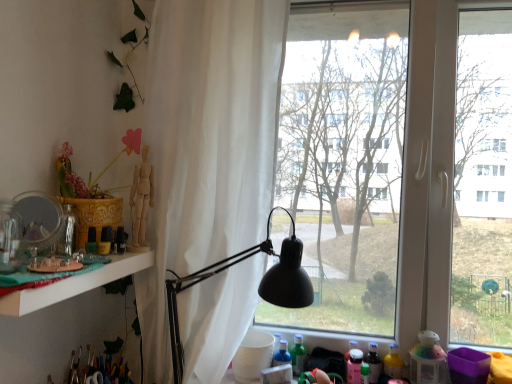
Locate an element on the screen. The image size is (512, 384). white sheer curtain at center is located at coordinates (207, 144).

Image resolution: width=512 pixels, height=384 pixels. What do you see at coordinates (298, 355) in the screenshot?
I see `green matte bottle at lower center, which is the second bottle in right-to-left order` at bounding box center [298, 355].

What do you see at coordinates (373, 363) in the screenshot? The width and height of the screenshot is (512, 384). I see `translucent plastic bottle at lower right, the 2th bottle from the left` at bounding box center [373, 363].

Find the location of a particular element. white sheer curtain at center is located at coordinates (207, 144).

Between black matte lamp at center and white glossy shelf at left, which one has less height?

white glossy shelf at left is shorter.

From a real-world perspective, is black matte lamp at center above or below white glossy shelf at left?

Clearly, from a real-world perspective, black matte lamp at center is below white glossy shelf at left.

Is black matte lamp at center oriented away from white glossy shelf at left?

black matte lamp at center does not have its back to white glossy shelf at left.

Considering the relative sizes of green matte bottle at lower center, placed as the 1th bottle when sorted from left to right, and translucent plastic toy at lower right in the image provided, is green matte bottle at lower center, placed as the 1th bottle when sorted from left to right, smaller than translucent plastic toy at lower right?

Yes, green matte bottle at lower center, placed as the 1th bottle when sorted from left to right, is smaller than translucent plastic toy at lower right.

Is green matte bottle at lower center, placed as the 1th bottle when sorted from left to right, thinner than translucent plastic toy at lower right?

Yes, green matte bottle at lower center, placed as the 1th bottle when sorted from left to right, is thinner than translucent plastic toy at lower right.

From a real-world perspective, who is located lower, green matte bottle at lower center, which is the second bottle in right-to-left order, or translucent plastic toy at lower right?

From a 3D spatial view, green matte bottle at lower center, which is the second bottle in right-to-left order, is below.

Considering the relative sizes of green matte bottle at lower center, placed as the 1th bottle when sorted from left to right, and translucent plastic toy at lower right in the image provided, is green matte bottle at lower center, placed as the 1th bottle when sorted from left to right, taller than translucent plastic toy at lower right?

In fact, green matte bottle at lower center, placed as the 1th bottle when sorted from left to right, may be shorter than translucent plastic toy at lower right.

Does wooden mannequin at left have a smaller size compared to green matte bottle at lower center, which is the second bottle in right-to-left order?

No.

Find the location of `person located in front of the green matte bottle at lower center, placed as the 1th bottle when sorted from left to right`. person located in front of the green matte bottle at lower center, placed as the 1th bottle when sorted from left to right is located at coordinates (141, 200).

How distant is wooden mannequin at left from green matte bottle at lower center, placed as the 1th bottle when sorted from left to right?

The distance of wooden mannequin at left from green matte bottle at lower center, placed as the 1th bottle when sorted from left to right, is 73.19 centimeters.

In the scene shown: Is wooden mannequin at left facing towards green matte bottle at lower center, which is the second bottle in right-to-left order?

No, wooden mannequin at left is not aimed at green matte bottle at lower center, which is the second bottle in right-to-left order.

Are translucent plastic toy at lower right and white glossy shelf at left making contact?

No, translucent plastic toy at lower right is not beside white glossy shelf at left.

Considering the relative sizes of translucent plastic toy at lower right and white glossy shelf at left in the image provided, is translucent plastic toy at lower right taller than white glossy shelf at left?

Yes.

Can we say translucent plastic toy at lower right lies outside white glossy shelf at left?

Yes, translucent plastic toy at lower right is located beyond the bounds of white glossy shelf at left.

From the image's perspective, relative to white glossy shelf at left, is translucent plastic toy at lower right above or below?

translucent plastic toy at lower right is below white glossy shelf at left.

Which is more to the left, black matte lamp at center or green matte bottle at lower center, which is the second bottle in right-to-left order?

black matte lamp at center.

From the image's perspective, is black matte lamp at center located beneath green matte bottle at lower center, placed as the 1th bottle when sorted from left to right?

Incorrect, from the image's perspective, black matte lamp at center is higher than green matte bottle at lower center, placed as the 1th bottle when sorted from left to right.

Where is `lamp in front of the green matte bottle at lower center, which is the second bottle in right-to-left order`? The height and width of the screenshot is (384, 512). lamp in front of the green matte bottle at lower center, which is the second bottle in right-to-left order is located at coordinates (258, 288).

Is black matte lamp at center far away from green matte bottle at lower center, placed as the 1th bottle when sorted from left to right?

Actually, black matte lamp at center and green matte bottle at lower center, placed as the 1th bottle when sorted from left to right, are a little close together.

In terms of height, does translucent plastic toy at lower right look taller or shorter compared to matte silver mirror at left?

Clearly, translucent plastic toy at lower right is taller compared to matte silver mirror at left.

From the image's perspective, is translucent plastic toy at lower right positioned above or below matte silver mirror at left?

Clearly, from the image's perspective, translucent plastic toy at lower right is below matte silver mirror at left.

Is translucent plastic toy at lower right not close to matte silver mirror at left?

That's right, there is a large distance between translucent plastic toy at lower right and matte silver mirror at left.

Which is more distant, (294, 359) or (222, 263)?

The point (294, 359) is farther.

From a real-world perspective, relative to black matte lamp at center, is green matte bottle at lower center, which is the second bottle in right-to-left order, vertically above or below?

green matte bottle at lower center, which is the second bottle in right-to-left order, is situated lower than black matte lamp at center in the real world.

Is green matte bottle at lower center, placed as the 1th bottle when sorted from left to right, positioned far away from black matte lamp at center?

No.

Could you measure the distance between green matte bottle at lower center, which is the second bottle in right-to-left order, and black matte lamp at center?

The distance of green matte bottle at lower center, which is the second bottle in right-to-left order, from black matte lamp at center is 16.64 inches.

At what (x,y) coordinates should I click in order to perform the action: click on shelf in front of the black matte lamp at center. Please return your answer as a coordinate pair (x, y). The height and width of the screenshot is (384, 512). Looking at the image, I should click on tap(75, 284).

Locate an element on the screen. This screenshot has width=512, height=384. bottle that is the 2nd one below the translucent plastic toy at lower right (from a real-world perspective) is located at coordinates [298, 355].

Based on their spatial positions, is white glossy shelf at left or transparent glass window at center closer to white sheer curtain at center?

The object closer to white sheer curtain at center is white glossy shelf at left.

When comparing their distances from translucent plastic bottle at lower right, the 2th bottle from the left, does green matte bottle at lower center, placed as the 1th bottle when sorted from left to right, or matte silver mirror at left seem closer?

The object closer to translucent plastic bottle at lower right, the 2th bottle from the left, is green matte bottle at lower center, placed as the 1th bottle when sorted from left to right.

Based on their spatial positions, is translucent plastic toy at lower right or matte silver mirror at left closer to wooden mannequin at left?

The object closer to wooden mannequin at left is matte silver mirror at left.

Looking at the image, which one is located further to translucent plastic toy at lower right, transparent glass window at center or translucent plastic bottle at lower right, the first bottle from the right?

transparent glass window at center is further to translucent plastic toy at lower right.

Looking at the image, which one is located closer to white sheer curtain at center, translucent plastic bottle at lower right, the 2th bottle from the left, or wooden mannequin at left?

The object closer to white sheer curtain at center is wooden mannequin at left.

Looking at the image, which one is located closer to transparent glass window at center, white sheer curtain at center or green matte bottle at lower center, which is the second bottle in right-to-left order?

white sheer curtain at center.

When comparing their distances from white sheer curtain at center, does black matte lamp at center or transparent glass window at center seem further?

transparent glass window at center is positioned further to the anchor white sheer curtain at center.

Based on their spatial positions, is translucent plastic toy at lower right or green matte bottle at lower center, which is the second bottle in right-to-left order, closer to transparent glass window at center?

translucent plastic toy at lower right is positioned closer to the anchor transparent glass window at center.

Locate an element on the screen. lamp between white glossy shelf at left and white sheer curtain at center along the z-axis is located at coordinates (258, 288).

Locate an element on the screen. The height and width of the screenshot is (384, 512). lamp situated between wooden mannequin at left and translucent plastic toy at lower right from left to right is located at coordinates (258, 288).

Where is `lamp between white sheer curtain at center and green matte bottle at lower center, placed as the 1th bottle when sorted from left to right, in the up-down direction`? lamp between white sheer curtain at center and green matte bottle at lower center, placed as the 1th bottle when sorted from left to right, in the up-down direction is located at coordinates (258, 288).

You are a GUI agent. You are given a task and a screenshot of the screen. Output one action in this format:
    pyautogui.click(x=<x>, y=<y>)
    Task: Click on the person between matte silver mirror at left and translucent plastic toy at lower right from left to right
    The width and height of the screenshot is (512, 384).
    Given the screenshot: What is the action you would take?
    pyautogui.click(x=141, y=200)